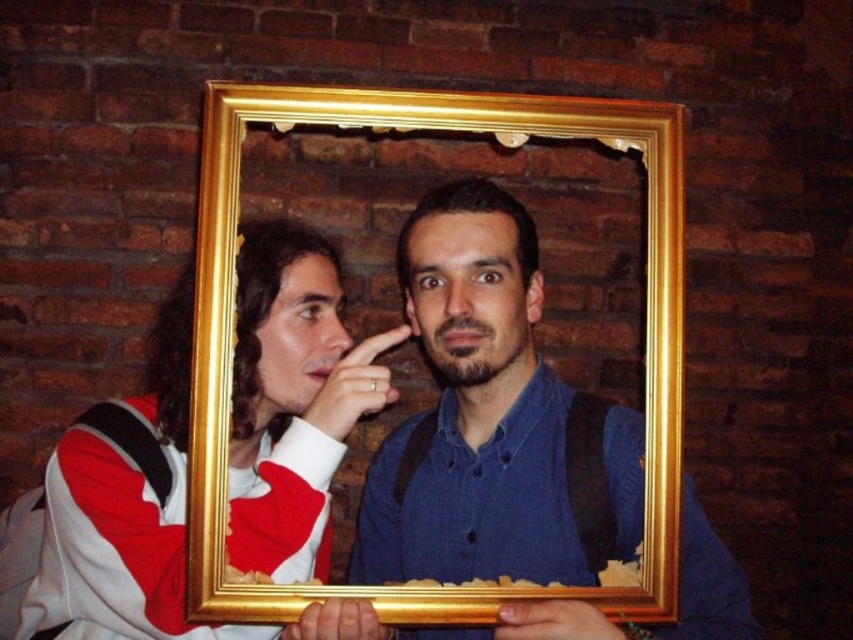
You are standing in front of the golden framed mirror in the image. There is a point marked at coordinates (293, 400). Which object in the scene is located at that point?

The point at coordinates (293, 400) corresponds to the matte white jacket at left.

You are an interior designer assessing the placement of objects in a room. You notice the matte white jacket at left. Where exactly is it positioned in the coordinate system provided?

The matte white jacket at left is located at point (293, 400) in the coordinate system.

You are standing in a room with a brick wall backdrop. You see a matte white jacket at left and a gold metallic picture frame at center. If you want to touch both items, which one would you reach first?

The matte white jacket at left is closer to you than the gold metallic picture frame at center, so you would reach the matte white jacket at left first.